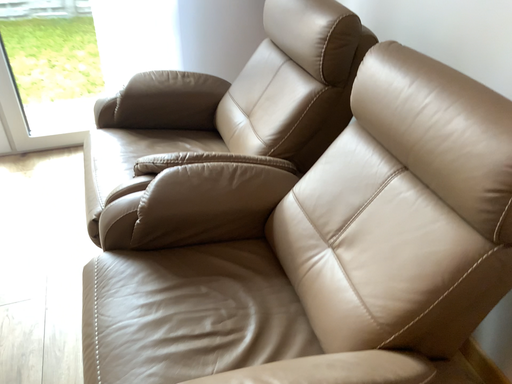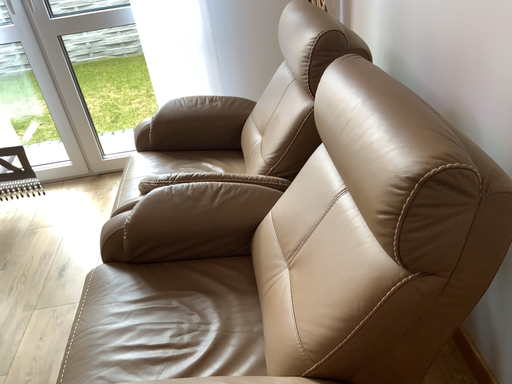
Question: Which way did the camera rotate in the video?

Choices:
 (A) rotated right
 (B) rotated left

Answer: (B)